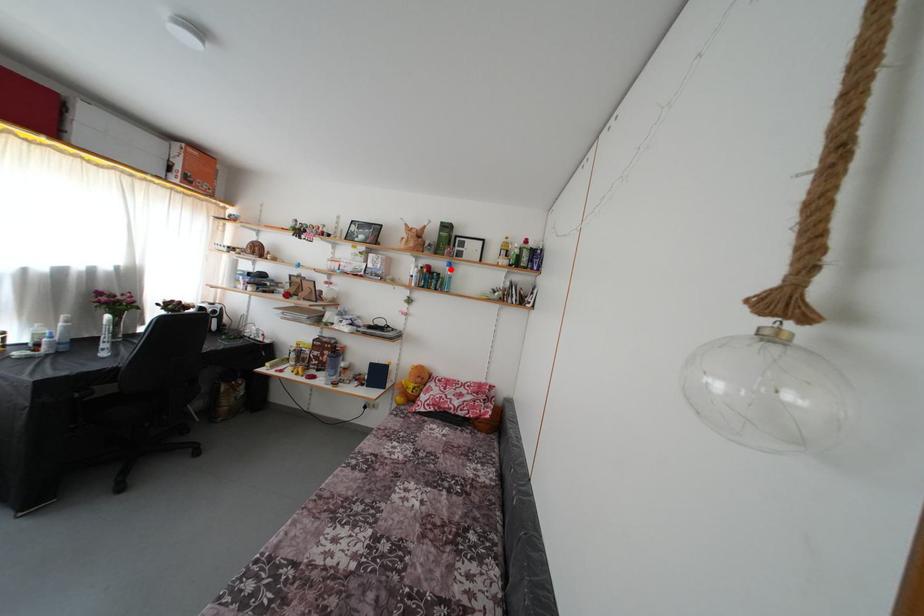
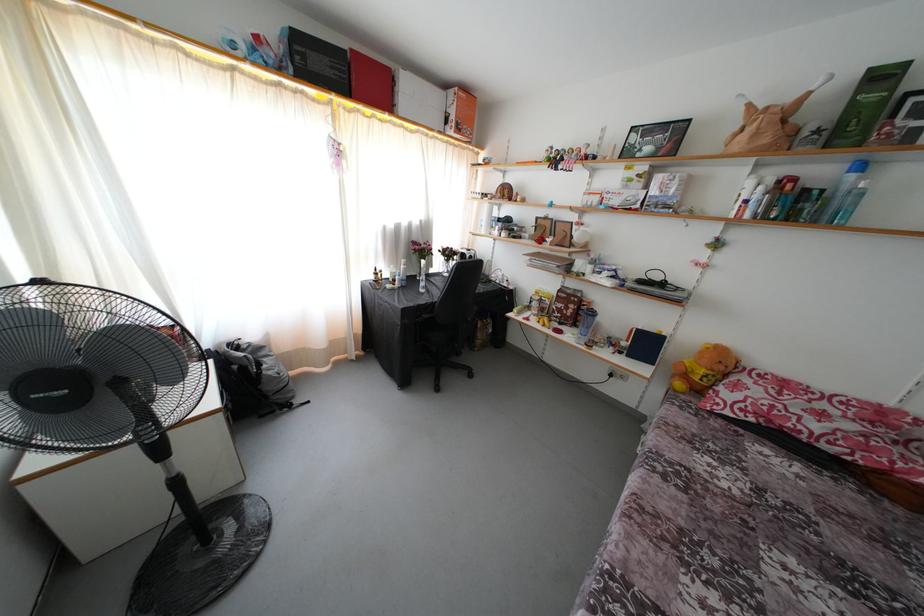
Question: I am providing you with two images of the same scene from different viewpoints. Image1 has a red point marked. In image2, the corresponding 3D location appears at what relative position? Reply with the corresponding letter.

Choices:
 (A) Closer
 (B) Farther

Answer: (B)